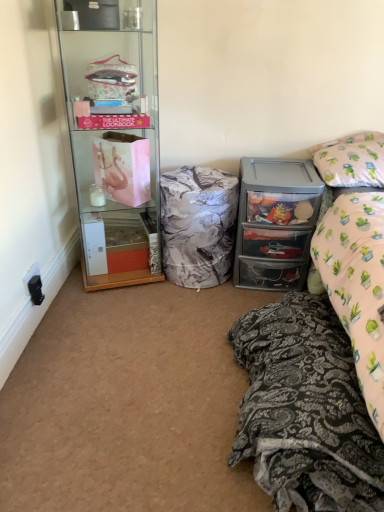
Question: From a real-world perspective, is clear plastic drawers at right located beneath clear glass cabinet at left?

Choices:
 (A) no
 (B) yes

Answer: (B)

Question: From the image's perspective, is clear plastic drawers at right beneath clear glass cabinet at left?

Choices:
 (A) no
 (B) yes

Answer: (B)

Question: Considering the relative positions of clear plastic drawers at right and clear glass cabinet at left in the image provided, is clear plastic drawers at right to the right of clear glass cabinet at left from the viewer's perspective?

Choices:
 (A) no
 (B) yes

Answer: (B)

Question: Is clear plastic drawers at right touching clear glass cabinet at left?

Choices:
 (A) no
 (B) yes

Answer: (A)

Question: Is clear plastic drawers at right turned away from clear glass cabinet at left?

Choices:
 (A) no
 (B) yes

Answer: (A)

Question: From their relative heights in the image, would you say clear glass cabinet at left is taller or shorter than black plastic power outlet at lower left?

Choices:
 (A) short
 (B) tall

Answer: (B)

Question: Is point coord(94,163) closer or farther from the camera than point coord(39,269)?

Choices:
 (A) closer
 (B) farther

Answer: (B)

Question: In terms of size, does clear glass cabinet at left appear bigger or smaller than black plastic power outlet at lower left?

Choices:
 (A) small
 (B) big

Answer: (B)

Question: Is clear glass cabinet at left in front of or behind black plastic power outlet at lower left in the image?

Choices:
 (A) behind
 (B) front

Answer: (B)

Question: Choose the correct answer: Is marble-patterned fabric at center inside black plastic power outlet at lower left or outside it?

Choices:
 (A) outside
 (B) inside

Answer: (A)

Question: From the image's perspective, is marble-patterned fabric at center located above or below black plastic power outlet at lower left?

Choices:
 (A) above
 (B) below

Answer: (A)

Question: In the image, is marble-patterned fabric at center on the left side or the right side of black plastic power outlet at lower left?

Choices:
 (A) left
 (B) right

Answer: (B)

Question: In terms of size, does marble-patterned fabric at center appear bigger or smaller than black plastic power outlet at lower left?

Choices:
 (A) small
 (B) big

Answer: (B)

Question: Is point (31, 273) positioned closer to the camera than point (236, 281)?

Choices:
 (A) closer
 (B) farther

Answer: (A)

Question: In terms of height, does black plastic power outlet at lower left look taller or shorter compared to clear plastic drawers at right?

Choices:
 (A) tall
 (B) short

Answer: (B)